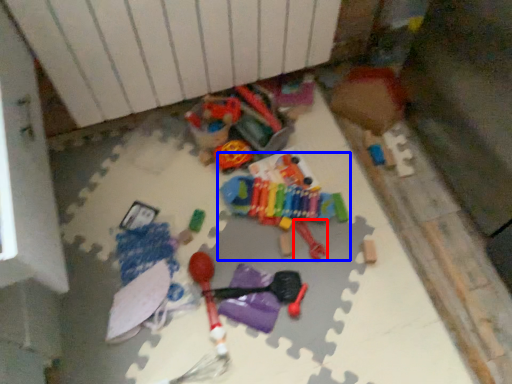
Question: Which object appears closest to the camera in this image, toy (highlighted by a red box) or toy (highlighted by a blue box)?

Choices:
 (A) toy
 (B) toy

Answer: (A)